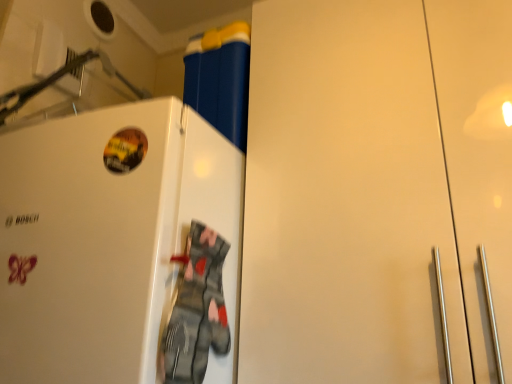
Describe the element at coordinates (196, 310) in the screenshot. This screenshot has height=384, width=512. I see `plaid fabric socks at center` at that location.

Find the location of a particular element. plaid fabric socks at center is located at coordinates (196, 310).

This screenshot has width=512, height=384. In order to click on plaid fabric socks at center in this screenshot , I will do `click(196, 310)`.